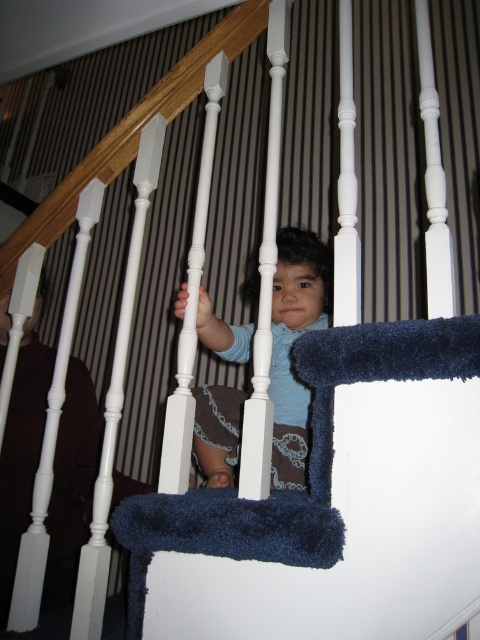
A child is standing on the blue plush stair at center while wearing the matte blue shirt at center. The parent wants to place a small toy between them. Is there enough space for the toy?

The blue plush stair at center and the matte blue shirt at center are 14.80 inches apart from each other, so there is enough space to place the small toy between them.

You are a parent trying to place a new decorative item on the staircase. The blue plush stair at center is located at coordinates point (311, 460). If you want to place the item 0.1 units to the right of this point, what coordinate would that be?

The new coordinate would be 0.820, 0.648 because moving 0.1 units to the right increases the x value while keeping the y value the same.